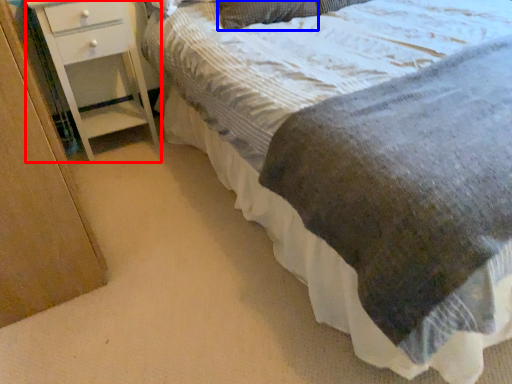
Question: Which of the following is the closest to the observer, chest of drawers (highlighted by a red box) or pillow (highlighted by a blue box)?

Choices:
 (A) chest of drawers
 (B) pillow

Answer: (A)